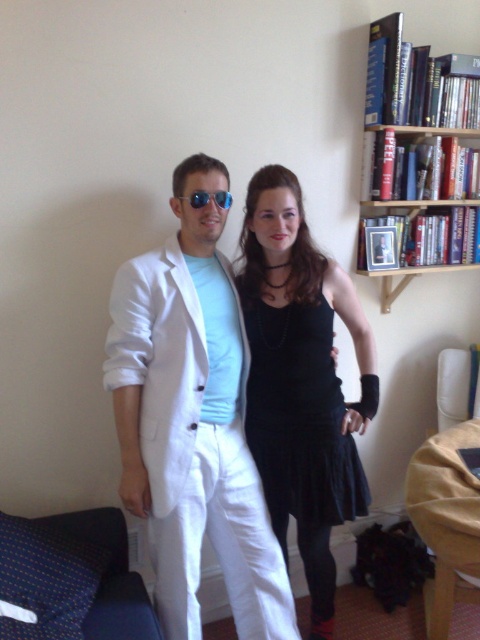
Question: Can you confirm if white matte suit at center is positioned below sunglasses at center?

Choices:
 (A) yes
 (B) no

Answer: (A)

Question: Which point is farther to the camera?

Choices:
 (A) (452, 227)
 (B) (222, 198)
 (C) (362, 376)
 (D) (210, 273)

Answer: (A)

Question: Which point appears closest to the camera in this image?

Choices:
 (A) (192, 424)
 (B) (325, 515)

Answer: (A)

Question: Which is nearer to the black satin dress at center?

Choices:
 (A) black velvet dress at center
 (B) wooden bookshelf at upper right

Answer: (A)

Question: Observing the image, what is the correct spatial positioning of white matte suit at center in reference to black satin dress at center?

Choices:
 (A) above
 (B) below

Answer: (A)

Question: Is black satin dress at center further to camera compared to wooden bookshelf at upper right?

Choices:
 (A) no
 (B) yes

Answer: (A)